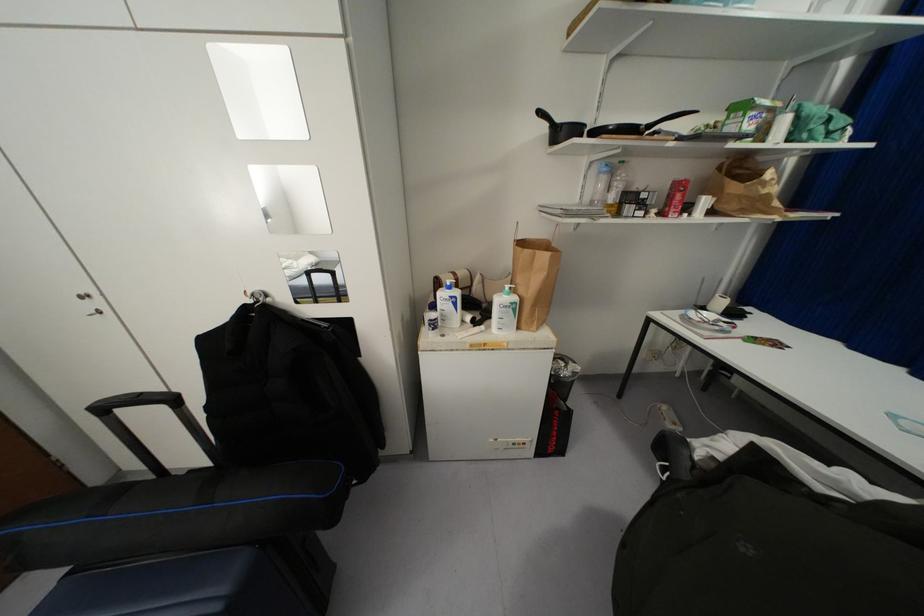
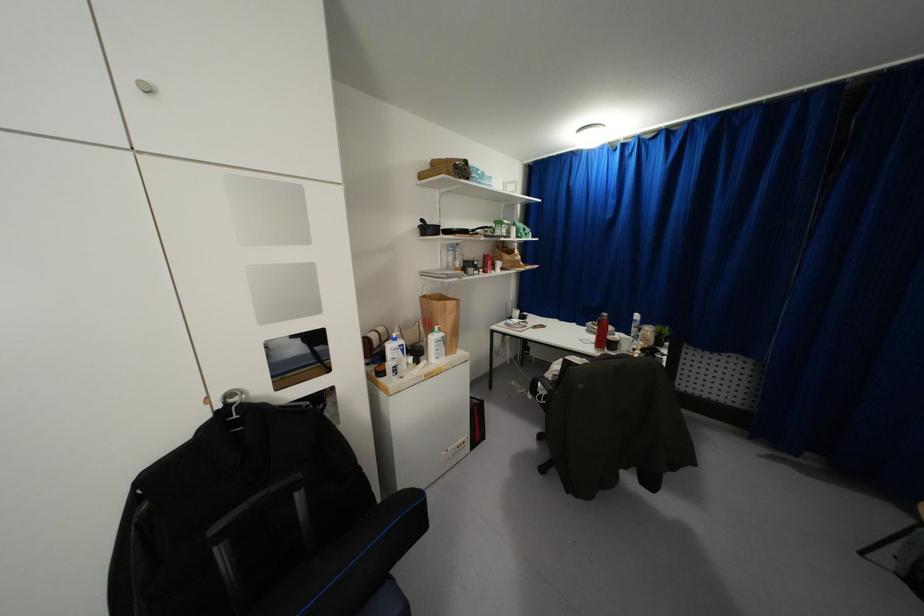
Where in the second image is the point corresponding to point 517,249 from the first image?

(434, 302)